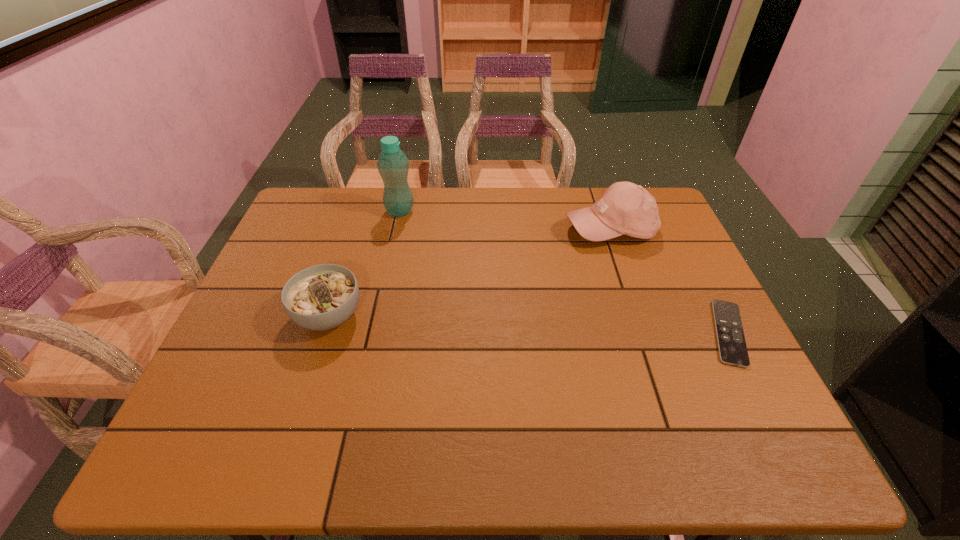
The height and width of the screenshot is (540, 960). Identify the location of blank region between the tallest object and the second tallest object. (505, 220).

Locate an element on the screen. Image resolution: width=960 pixels, height=540 pixels. vacant space that's between the soup bowl and the shortest object is located at coordinates (529, 325).

You are a GUI agent. You are given a task and a screenshot of the screen. Output one action in this format:
    pyautogui.click(x=<x>, y=<y>)
    Task: Click on the unoccupied position between the second shortest object and the water bottle
    The image size is (960, 540).
    Given the screenshot: What is the action you would take?
    pyautogui.click(x=365, y=264)

I want to click on free point between the second shortest object and the tallest object, so click(365, 264).

At what (x,y) coordinates should I click in order to perform the action: click on unoccupied position between the tallest object and the second tallest object. Please return your answer as a coordinate pair (x, y). The height and width of the screenshot is (540, 960). Looking at the image, I should click on (505, 220).

Where is `free space between the third tallest object and the second object from right to left`? free space between the third tallest object and the second object from right to left is located at coordinates (469, 272).

The width and height of the screenshot is (960, 540). I want to click on object that is the second closest to the second tallest object, so click(393, 165).

Locate which object ranks third in proximity to the third shortest object. Please provide its 2D coordinates. Your answer should be formatted as a tuple, i.e. [(x, y)], where the tuple contains the x and y coordinates of a point satisfying the conditions above.

[(321, 297)]

Identify the location of vacant area in the image that satisfies the following two spatial constraints: 1. on the back side of the water bottle; 2. on the right side of the soup bowl. The image size is (960, 540). (363, 211).

At what (x,y) coordinates should I click in order to perform the action: click on vacant space that satisfies the following two spatial constraints: 1. on the front side of the second shortest object; 2. on the right side of the remote control. Please return your answer as a coordinate pair (x, y). The width and height of the screenshot is (960, 540). Looking at the image, I should click on (324, 333).